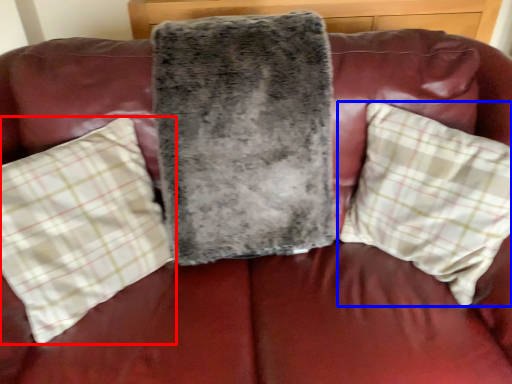
Question: Among these objects, which one is nearest to the camera, pillow (highlighted by a red box) or pillow (highlighted by a blue box)?

Choices:
 (A) pillow
 (B) pillow

Answer: (A)